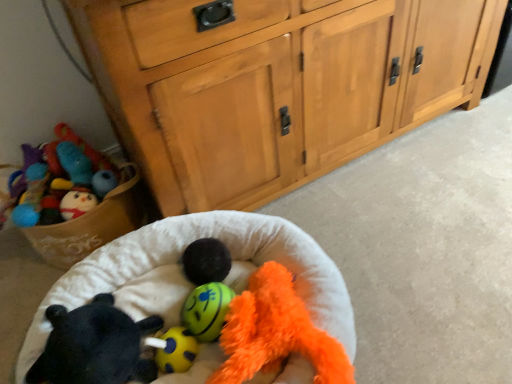
Locate an element on the screen. The height and width of the screenshot is (384, 512). vacant area in front of wooden cabinet at center is located at coordinates (398, 244).